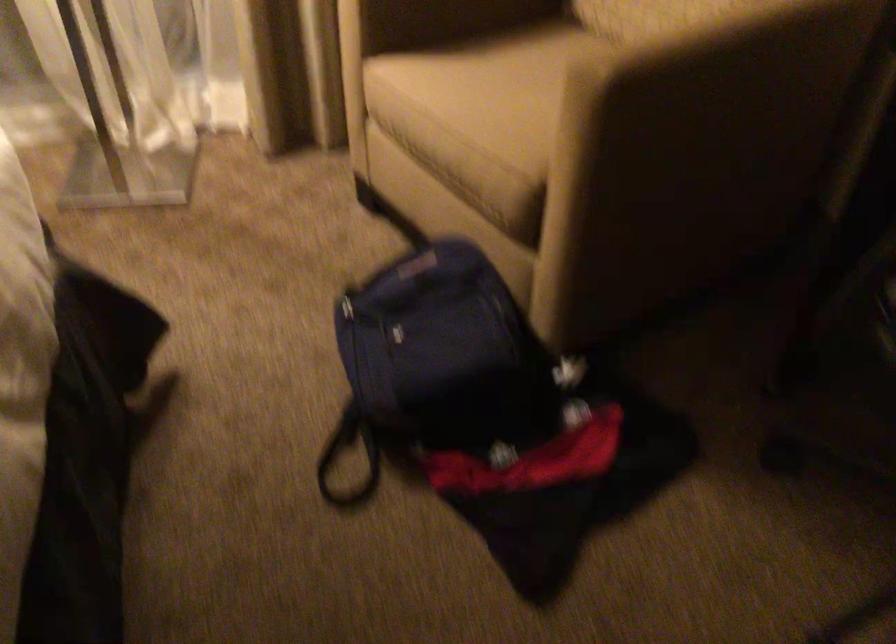
Where would you grasp the black backpack strap? Please return your answer as a coordinate pair (x, y).

(442, 366)